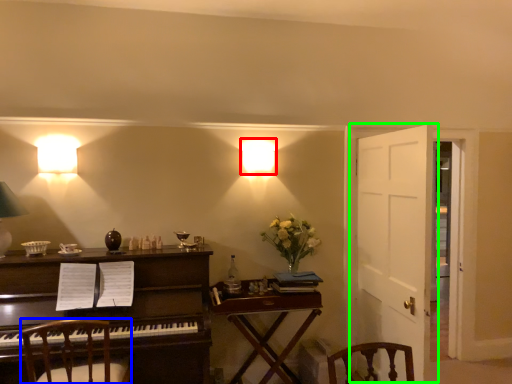
Question: Which object is the closest to the lamp (highlighted by a red box)? Choose among these: chair (highlighted by a blue box) or door (highlighted by a green box).

Choices:
 (A) chair
 (B) door

Answer: (B)